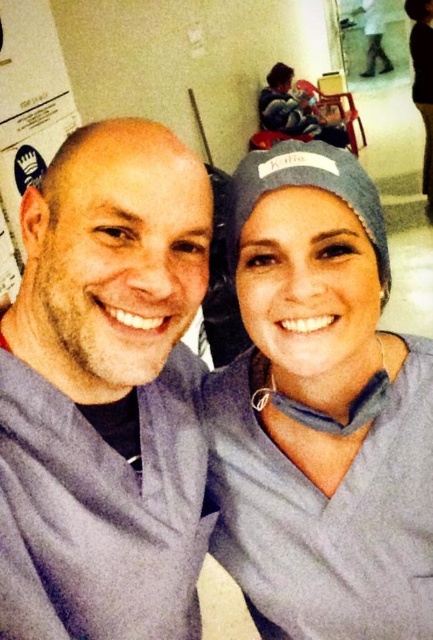
Question: Which point appears farthest from the camera in this image?

Choices:
 (A) (416, 52)
 (B) (145, 614)

Answer: (A)

Question: Does matte gray scrub at center have a greater width compared to gray fabric cap at upper center?

Choices:
 (A) yes
 (B) no

Answer: (A)

Question: Which of the following is the closest to the observer?

Choices:
 (A) (174, 561)
 (B) (427, 193)

Answer: (A)

Question: Is gray matte scrubs at left further to camera compared to gray fabric cap at upper center?

Choices:
 (A) no
 (B) yes

Answer: (A)

Question: Does gray matte scrubs at left lie behind gray fabric cap at upper center?

Choices:
 (A) yes
 (B) no

Answer: (B)

Question: Which of the following is the closest to the observer?

Choices:
 (A) gray fabric cap at upper center
 (B) matte gray scrub at center

Answer: (B)